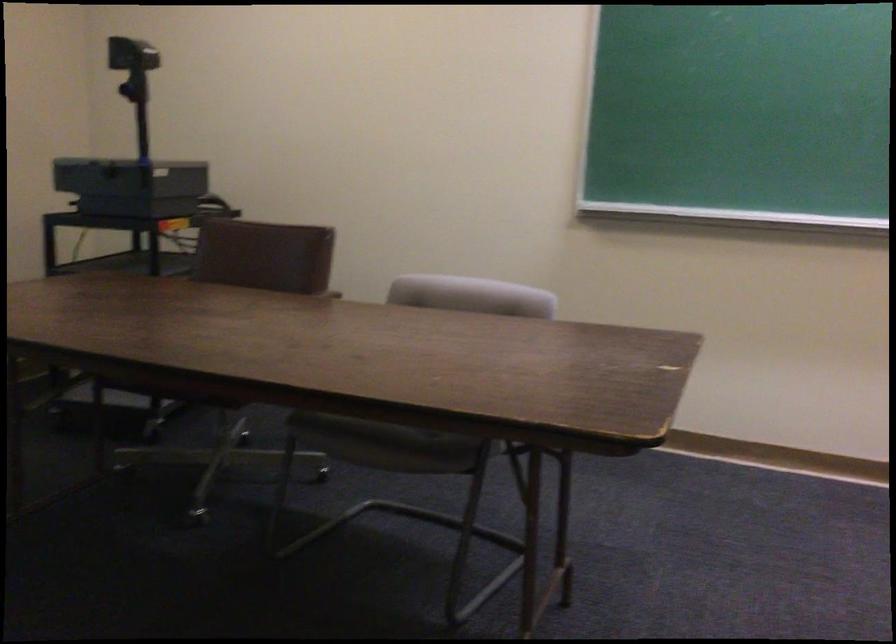
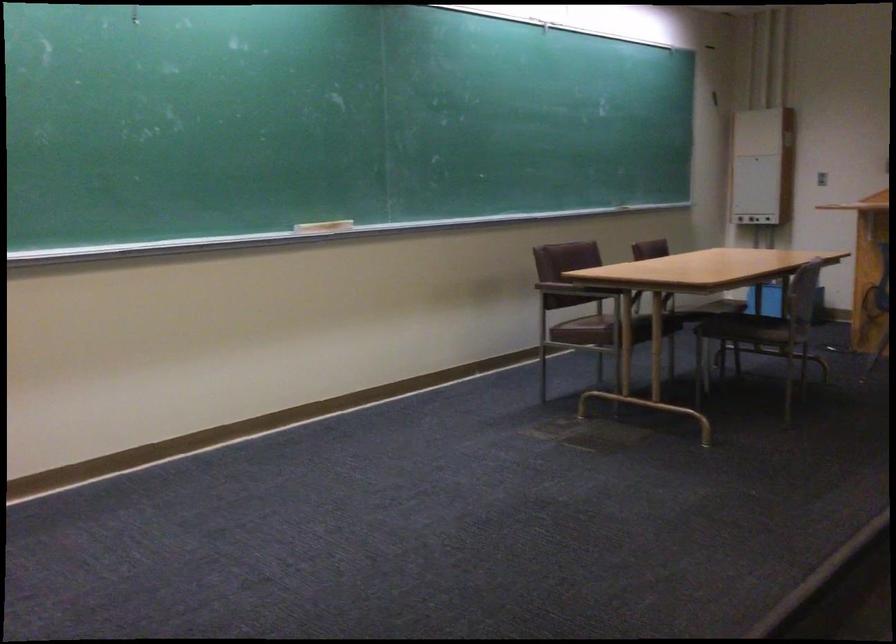
Question: Based on the continuous images, in which direction is the camera rotating? Reply with the corresponding letter.

Choices:
 (A) Left
 (B) Right
 (C) Up
 (D) Down

Answer: (B)